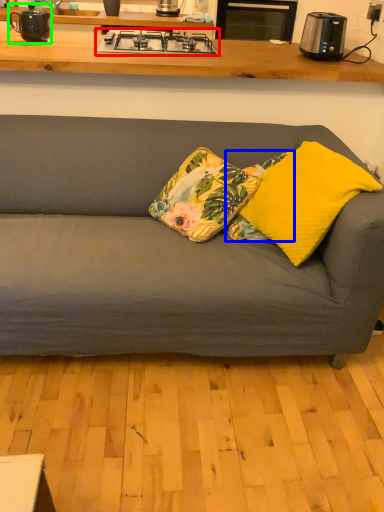
Question: Which object is the closest to the gas stove (highlighted by a red box)? Choose among these: pillow (highlighted by a blue box) or appliance (highlighted by a green box).

Choices:
 (A) pillow
 (B) appliance

Answer: (B)